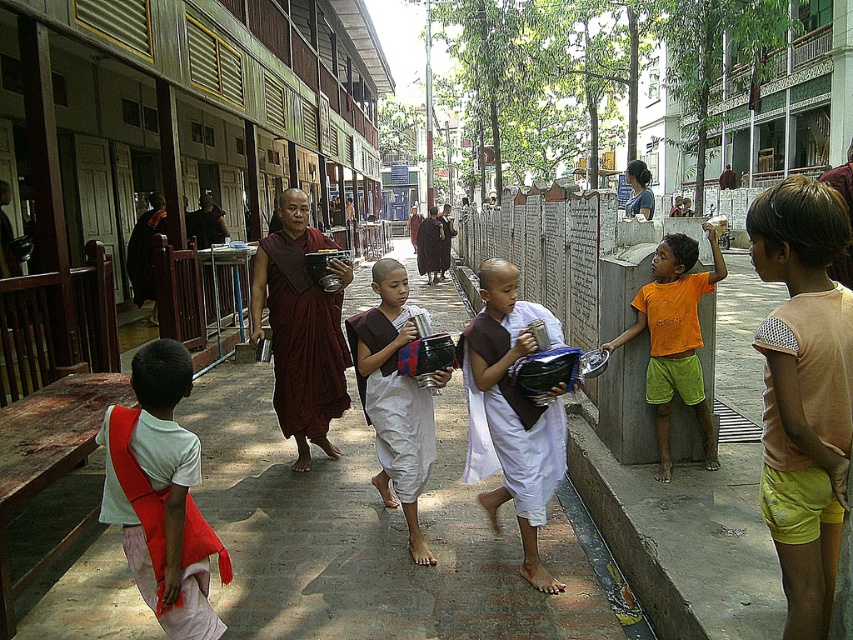
Question: Does brick pavement at center have a larger size compared to white cotton robe at center?

Choices:
 (A) yes
 (B) no

Answer: (A)

Question: Which point appears closest to the camera in this image?

Choices:
 (A) (473, 339)
 (B) (262, 435)
 (C) (335, 451)
 (D) (184, 483)

Answer: (D)

Question: Estimate the real-world distances between objects in this image. Which object is closer to the white cotton shirt at lower left?

Choices:
 (A) maroon silk robe at center
 (B) brown cotton shirt at center

Answer: (B)

Question: Is brick pavement at center closer to camera compared to orange cotton shirt at right?

Choices:
 (A) no
 (B) yes

Answer: (B)

Question: Which of the following is the farthest from the observer?

Choices:
 (A) (468, 314)
 (B) (375, 433)
 (C) (721, 269)
 (D) (194, 611)

Answer: (A)

Question: Does white cotton shirt at lower left have a lesser width compared to brown cotton shirt at center?

Choices:
 (A) yes
 (B) no

Answer: (B)